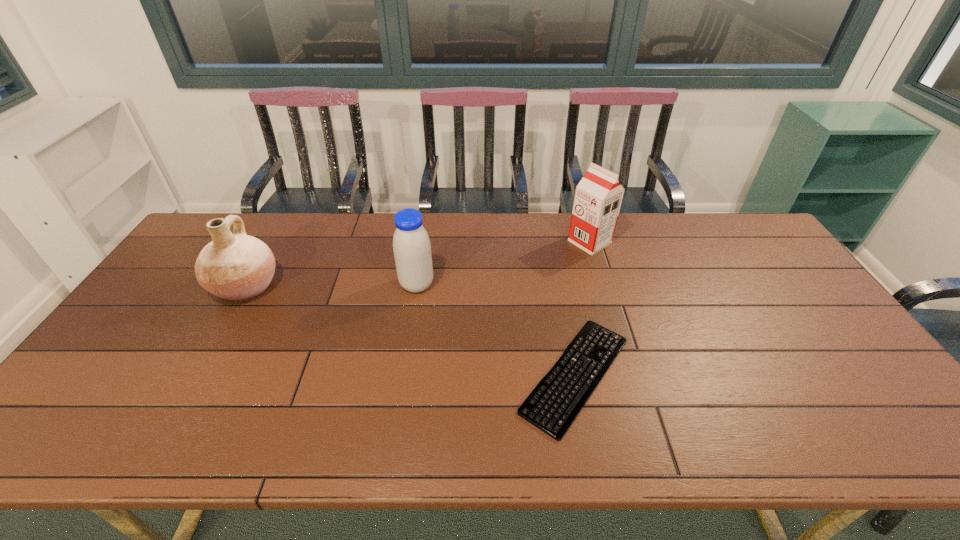
The image size is (960, 540). I want to click on blank area located 0.400m on the left of the shortest object, so click(353, 375).

The image size is (960, 540). I want to click on object located in the far edge section of the desktop, so click(598, 197).

Find the location of `object that is at the near edge`. object that is at the near edge is located at coordinates (553, 405).

Identify the location of object that is at the left edge. The image size is (960, 540). (237, 267).

In the image, there is a desktop. In order to click on vacant space at the far edge in this screenshot , I will do `click(273, 241)`.

You are a GUI agent. You are given a task and a screenshot of the screen. Output one action in this format:
    pyautogui.click(x=<x>, y=<y>)
    Task: Click on the free location at the near edge
    This screenshot has width=960, height=540.
    Given the screenshot: What is the action you would take?
    pyautogui.click(x=483, y=439)

This screenshot has width=960, height=540. I want to click on blank space at the far left corner, so click(199, 233).

In the image, there is a desktop. Identify the location of vacant space at the near left corner. This screenshot has width=960, height=540. (62, 416).

I want to click on free space between the farthest object and the nearer soya milk, so click(x=503, y=264).

I want to click on free space between the nearer soya milk and the farther soya milk, so 503,264.